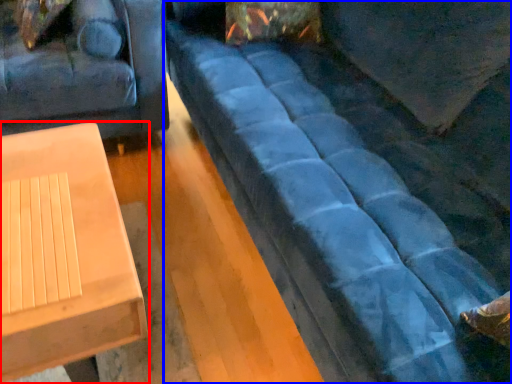
Question: Which object appears farthest to the camera in this image, table (highlighted by a red box) or studio couch (highlighted by a blue box)?

Choices:
 (A) table
 (B) studio couch

Answer: (A)